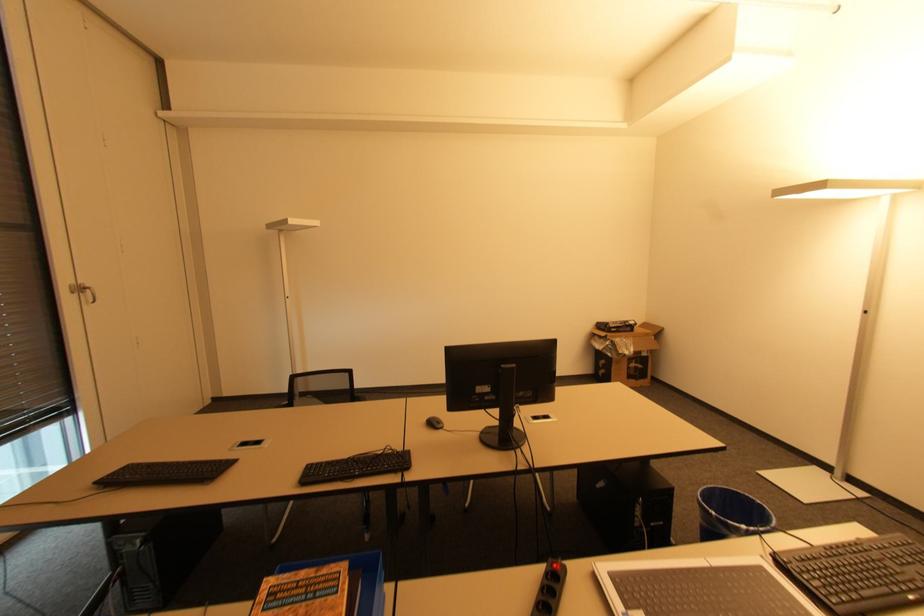
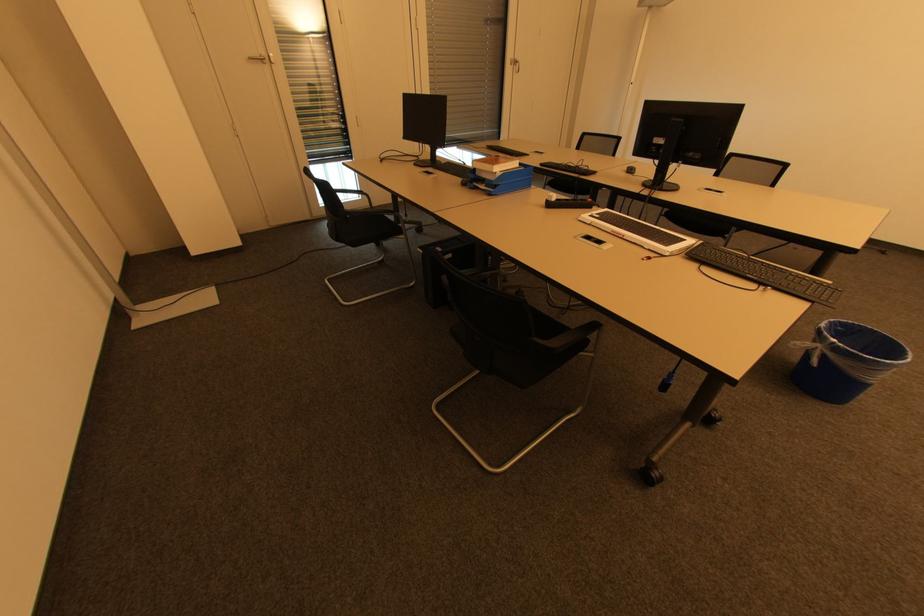
In the second image, find the point that corresponds to (444,428) in the first image.

(634, 174)